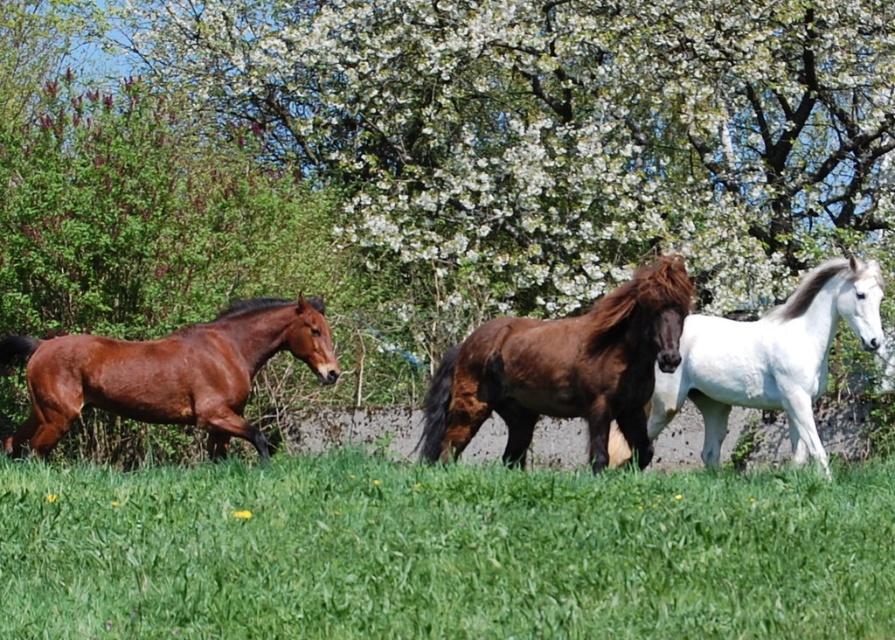
Question: Does brown glossy horse at center have a larger size compared to white glossy horse at right?

Choices:
 (A) yes
 (B) no

Answer: (B)

Question: Does brown glossy horse at center come in front of shiny brown horse at left?

Choices:
 (A) yes
 (B) no

Answer: (A)

Question: Among these objects, which one is farthest from the camera?

Choices:
 (A) brown glossy horse at center
 (B) green grass at center
 (C) shiny brown horse at left
 (D) white glossy horse at right

Answer: (C)

Question: Which object appears farthest from the camera in this image?

Choices:
 (A) white glossy horse at right
 (B) brown glossy horse at center

Answer: (A)

Question: Can you confirm if brown glossy horse at center is positioned above white glossy horse at right?

Choices:
 (A) no
 (B) yes

Answer: (B)

Question: Estimate the real-world distances between objects in this image. Which object is farther from the brown glossy horse at center?

Choices:
 (A) green grass at center
 (B) shiny brown horse at left
 (C) white glossy horse at right

Answer: (B)